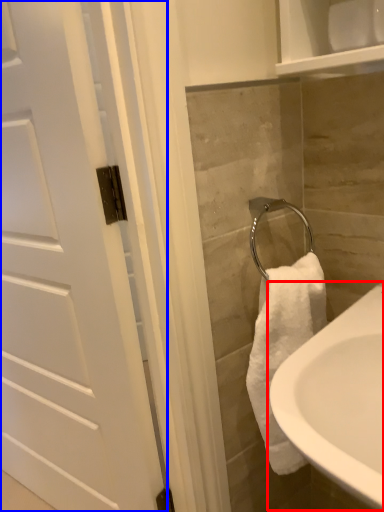
Question: Among these objects, which one is nearest to the camera, sink (highlighted by a red box) or door (highlighted by a blue box)?

Choices:
 (A) sink
 (B) door

Answer: (A)